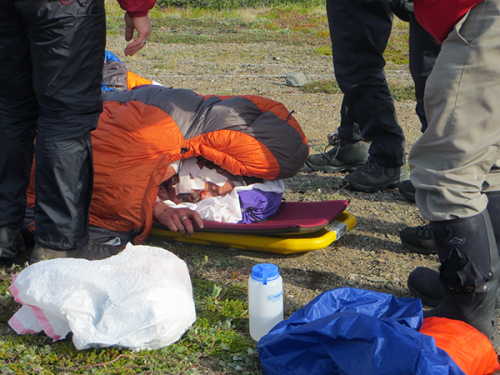
In order to click on trash bag in this screenshot , I will do [x=85, y=305].